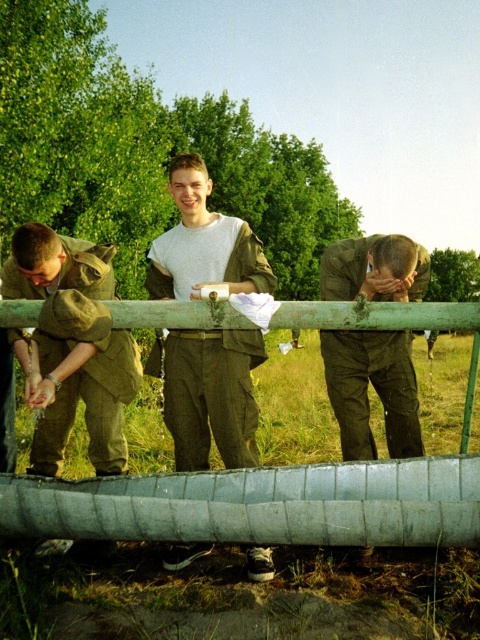
You are a park ranger inspecting a historical reenactment site. You notice the matte olive green uniform at center and the green painted metal rail at center. Based on the distance between them, can you determine if the uniform is within the 30 inch safety zone required for such displays?

The matte olive green uniform at center is 31.33 inches from the green painted metal rail at center, which exceeds the 30 inch safety zone requirement. Therefore, the uniform is outside the required safety distance and needs to be moved closer.

You are a photographer setting up a shot of the scene described. You want to ensure that both the camouflage fabric uniform at left and the green painted metal rail at center are clearly visible in the frame. Given their sizes, which object should you focus on first to ensure proper exposure, and why?

The camouflage fabric uniform at left is larger in size compared to the green painted metal rail at center, so you should focus on the camouflage fabric uniform at left first to ensure proper exposure, as larger objects often require more precise focus to capture details effectively.